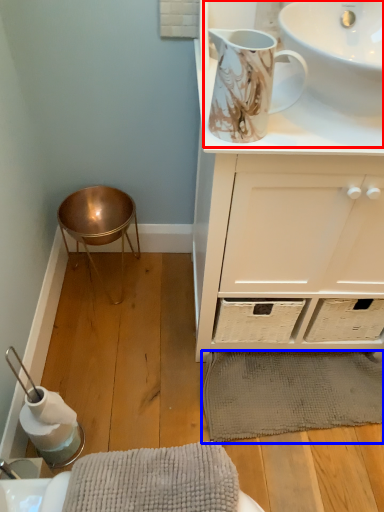
Question: Among these objects, which one is nearest to the camera, sink (highlighted by a red box) or bath mat (highlighted by a blue box)?

Choices:
 (A) sink
 (B) bath mat

Answer: (A)